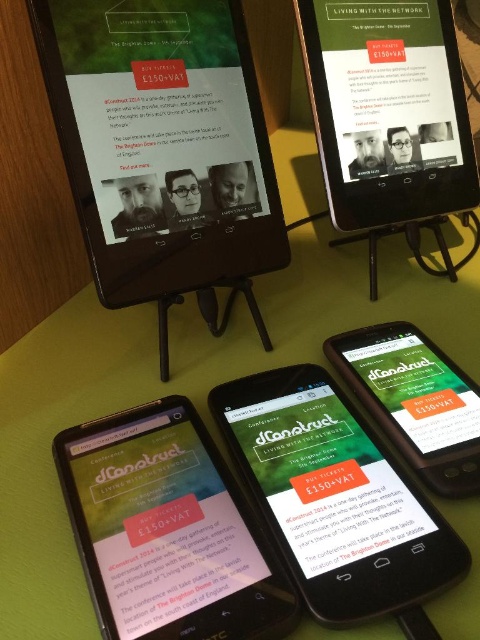
Question: Can you confirm if matte black tablet at upper center is wider than green matte smartphone at center?

Choices:
 (A) yes
 (B) no

Answer: (A)

Question: Which of the following is the farthest from the observer?

Choices:
 (A) matte black tablet at upper center
 (B) green matte smartphone at center

Answer: (B)

Question: Which of the following is the closest to the observer?

Choices:
 (A) (314, 483)
 (B) (108, 596)
 (C) (355, 365)

Answer: (B)

Question: Is the position of matte green phone at center more distant than that of green matte smartphone at center?

Choices:
 (A) yes
 (B) no

Answer: (B)

Question: Based on their relative distances, which object is farther from the green matte smartphone at center?

Choices:
 (A) matte black tablet at upper center
 (B) matte green phone at center

Answer: (B)

Question: Can you confirm if matte black tablet at upper center is wider than green matte smartphone at center?

Choices:
 (A) no
 (B) yes

Answer: (B)